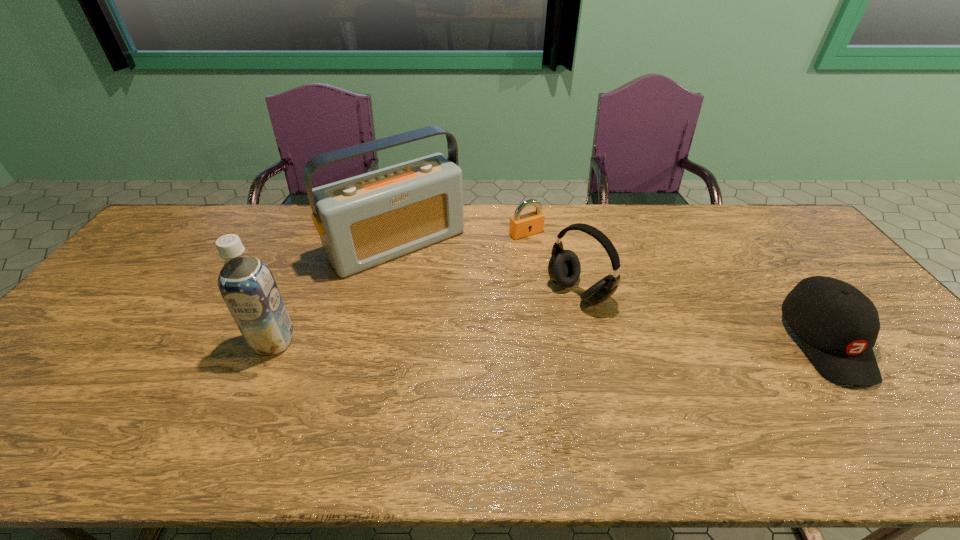
At what (x,y) coordinates should I click in order to perform the action: click on free space on the desktop that is between the soya milk and the baseball cap and is positioned on the front-facing side of the radio receiver. Please return your answer as a coordinate pair (x, y). The height and width of the screenshot is (540, 960). Looking at the image, I should click on (479, 341).

Image resolution: width=960 pixels, height=540 pixels. What are the coordinates of `vacant spot on the desktop that is between the soya milk and the rightmost object and is positioned on the ear cups of the headset` in the screenshot? It's located at (513, 341).

Identify the location of free space on the desktop that is between the soya milk and the rightmost object and is positioned to unlock the padlock from the front. (627, 341).